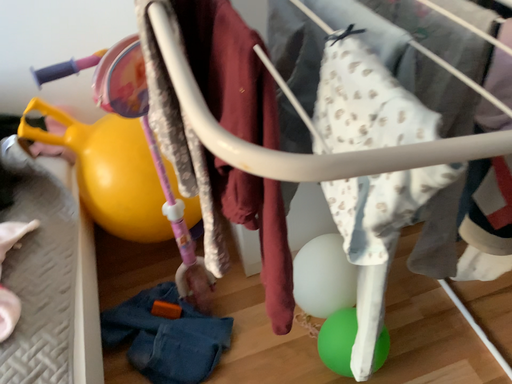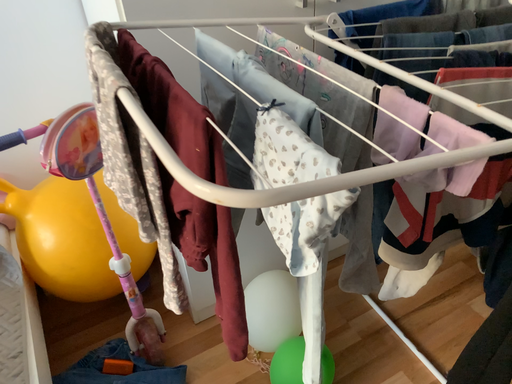
Question: Which way did the camera rotate in the video?

Choices:
 (A) rotated right
 (B) rotated left

Answer: (A)